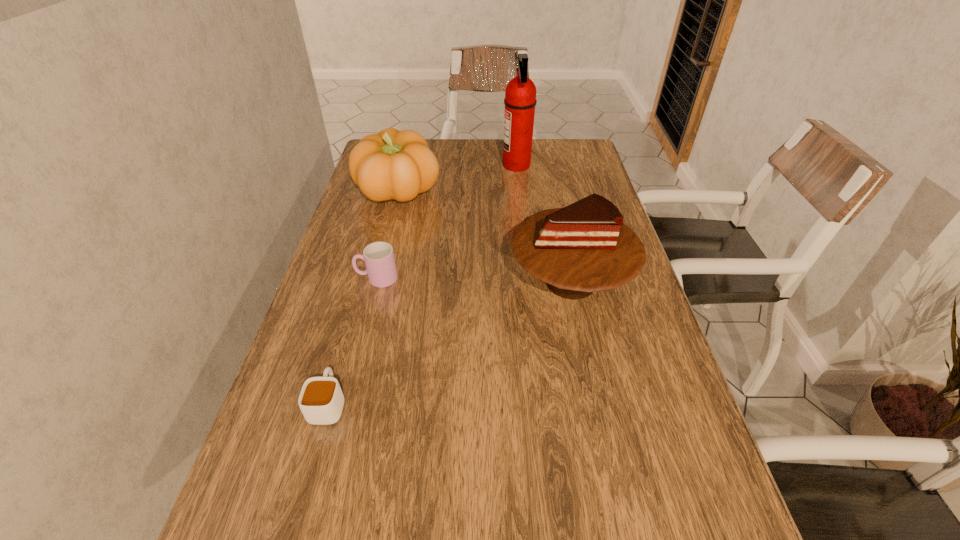
The image size is (960, 540). What are the coordinates of `vacant area that satisfies the following two spatial constraints: 1. on the side of the tallest object near the handle; 2. on the left side of the cake` in the screenshot? It's located at (531, 281).

Locate an element on the screen. This screenshot has height=540, width=960. free space that satisfies the following two spatial constraints: 1. on the side of the fire extinguisher near the handle; 2. on the left side of the cake is located at coordinates (531, 281).